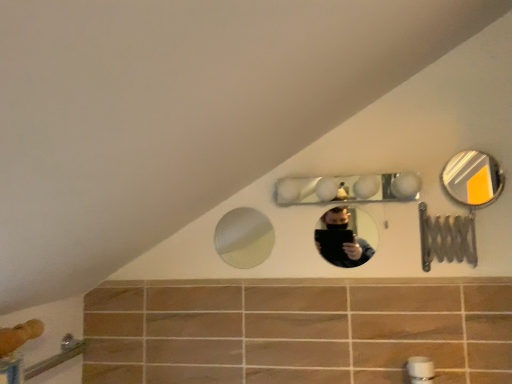
What do you see at coordinates (350, 253) in the screenshot? I see `clear glass mirror at upper center, the 2th mirror when ordered from right to left` at bounding box center [350, 253].

Measure the distance between point (332,188) and camera.

The distance of point (332,188) from camera is 1.30 meters.

How much space does white glossy mirror at upper center, positioned as the second mirror in left-to-right order, occupy vertically?

white glossy mirror at upper center, positioned as the second mirror in left-to-right order, is 4.02 inches tall.

The image size is (512, 384). In order to click on white textured mirror at center, the 1th mirror viewed from the left in this screenshot , I will do `click(244, 238)`.

Where is `metallic silver mirror at upper right, arranged as the fourth mirror when viewed from the left`? Image resolution: width=512 pixels, height=384 pixels. metallic silver mirror at upper right, arranged as the fourth mirror when viewed from the left is located at coordinates (472, 178).

Does clear glass mirror at upper center, the 2th mirror when ordered from right to left, have a greater width compared to white textured mirror at center, the fourth mirror positioned from the right?

Indeed, clear glass mirror at upper center, the 2th mirror when ordered from right to left, has a greater width compared to white textured mirror at center, the fourth mirror positioned from the right.

Is clear glass mirror at upper center, the 3th mirror viewed from the left, not close to white textured mirror at center, the 1th mirror viewed from the left?

clear glass mirror at upper center, the 3th mirror viewed from the left, is positioned a significant distance from white textured mirror at center, the 1th mirror viewed from the left.

I want to click on mirror below the clear glass mirror at upper center, the 3th mirror viewed from the left (from the image's perspective), so click(244, 238).

Would you say clear glass mirror at upper center, the 2th mirror when ordered from right to left, is inside or outside white textured mirror at center, the 1th mirror viewed from the left?

clear glass mirror at upper center, the 2th mirror when ordered from right to left, exists outside the volume of white textured mirror at center, the 1th mirror viewed from the left.

Is point (362, 246) positioned after point (502, 184)?

No, (362, 246) is closer to viewer.

Is there a large distance between clear glass mirror at upper center, the 2th mirror when ordered from right to left, and metallic silver mirror at upper right, arranged as the fourth mirror when viewed from the left?

They are positioned close to each other.

Would you say clear glass mirror at upper center, the 3th mirror viewed from the left, contains metallic silver mirror at upper right, arranged as the fourth mirror when viewed from the left?

No.

Which object is positioned more to the left, clear glass mirror at upper center, the 3th mirror viewed from the left, or white glossy mirror at upper center, positioned as the second mirror in left-to-right order?

From the viewer's perspective, white glossy mirror at upper center, positioned as the second mirror in left-to-right order, appears more on the left side.

Does point (343, 227) come closer to viewer compared to point (356, 176)?

That is False.

Would you say clear glass mirror at upper center, the 3th mirror viewed from the left, is inside or outside white glossy mirror at upper center, which is the third mirror from right to left?

clear glass mirror at upper center, the 3th mirror viewed from the left, is outside white glossy mirror at upper center, which is the third mirror from right to left.

From a real-world perspective, is clear glass mirror at upper center, the 2th mirror when ordered from right to left, positioned over white glossy mirror at upper center, positioned as the second mirror in left-to-right order, based on gravity?

No, from a real-world perspective, clear glass mirror at upper center, the 2th mirror when ordered from right to left, is not on top of white glossy mirror at upper center, positioned as the second mirror in left-to-right order.

Is white glossy mirror at upper center, positioned as the second mirror in left-to-right order, to the left of clear glass mirror at upper center, the 2th mirror when ordered from right to left, from the viewer's perspective?

Yes, white glossy mirror at upper center, positioned as the second mirror in left-to-right order, is to the left of clear glass mirror at upper center, the 2th mirror when ordered from right to left.

Locate an element on the screen. mirror that is the 2nd object located in front of the clear glass mirror at upper center, the 3th mirror viewed from the left is located at coordinates click(x=348, y=189).

Is clear glass mirror at upper center, the 2th mirror when ordered from right to left, at the back of white glossy mirror at upper center, which is the third mirror from right to left?

No, white glossy mirror at upper center, which is the third mirror from right to left, is not facing the opposite direction of clear glass mirror at upper center, the 2th mirror when ordered from right to left.

Is white glossy mirror at upper center, positioned as the second mirror in left-to-right order, shorter than clear glass mirror at upper center, the 3th mirror viewed from the left?

Yes, white glossy mirror at upper center, positioned as the second mirror in left-to-right order, is shorter than clear glass mirror at upper center, the 3th mirror viewed from the left.

Find the location of a particular element. This screenshot has width=512, height=384. mirror that is the 2nd object to the left of the metallic silver mirror at upper right, which is counted as the first mirror, starting from the right, starting at the anchor is located at coordinates [348, 189].

Is white glossy mirror at upper center, positioned as the second mirror in left-to-right order, a part of metallic silver mirror at upper right, which is counted as the first mirror, starting from the right?

No, metallic silver mirror at upper right, which is counted as the first mirror, starting from the right, does not contain white glossy mirror at upper center, positioned as the second mirror in left-to-right order.

Considering their positions, is metallic silver mirror at upper right, which is counted as the first mirror, starting from the right, located in front of or behind white glossy mirror at upper center, positioned as the second mirror in left-to-right order?

metallic silver mirror at upper right, which is counted as the first mirror, starting from the right, is behind white glossy mirror at upper center, positioned as the second mirror in left-to-right order.

Can you tell me how much metallic silver mirror at upper right, which is counted as the first mirror, starting from the right, and white glossy mirror at upper center, which is the third mirror from right to left, differ in facing direction?

The facing directions of metallic silver mirror at upper right, which is counted as the first mirror, starting from the right, and white glossy mirror at upper center, which is the third mirror from right to left, are 0.0187 degrees apart.

Is point (456, 193) closer to camera compared to point (372, 255)?

No, (456, 193) is behind (372, 255).

Considering the sizes of metallic silver mirror at upper right, arranged as the fourth mirror when viewed from the left, and clear glass mirror at upper center, the 3th mirror viewed from the left, in the image, is metallic silver mirror at upper right, arranged as the fourth mirror when viewed from the left, bigger or smaller than clear glass mirror at upper center, the 3th mirror viewed from the left,?

Considering their sizes, metallic silver mirror at upper right, arranged as the fourth mirror when viewed from the left, takes up more space than clear glass mirror at upper center, the 3th mirror viewed from the left.

Looking at this image, is metallic silver mirror at upper right, arranged as the fourth mirror when viewed from the left, aimed at clear glass mirror at upper center, the 2th mirror when ordered from right to left?

No, metallic silver mirror at upper right, arranged as the fourth mirror when viewed from the left, does not turn towards clear glass mirror at upper center, the 2th mirror when ordered from right to left.

Is metallic silver mirror at upper right, which is counted as the first mirror, starting from the right, inside or outside of clear glass mirror at upper center, the 3th mirror viewed from the left?

metallic silver mirror at upper right, which is counted as the first mirror, starting from the right, is spatially situated outside clear glass mirror at upper center, the 3th mirror viewed from the left.

Based on the photo, how many degrees apart are the facing directions of metallic silver mirror at upper right, which is counted as the first mirror, starting from the right, and white textured mirror at center, the 1th mirror viewed from the left?

The angular difference between metallic silver mirror at upper right, which is counted as the first mirror, starting from the right, and white textured mirror at center, the 1th mirror viewed from the left, is 0.99 degrees.

Can you see metallic silver mirror at upper right, which is counted as the first mirror, starting from the right, touching white textured mirror at center, the 1th mirror viewed from the left?

No, metallic silver mirror at upper right, which is counted as the first mirror, starting from the right, is not in contact with white textured mirror at center, the 1th mirror viewed from the left.

Considering the sizes of objects metallic silver mirror at upper right, arranged as the fourth mirror when viewed from the left, and white textured mirror at center, the 1th mirror viewed from the left, in the image provided, who is wider, metallic silver mirror at upper right, arranged as the fourth mirror when viewed from the left, or white textured mirror at center, the 1th mirror viewed from the left,?

metallic silver mirror at upper right, arranged as the fourth mirror when viewed from the left.

In the scene shown: Between metallic silver mirror at upper right, arranged as the fourth mirror when viewed from the left, and white textured mirror at center, the 1th mirror viewed from the left, which one is positioned behind?

Positioned behind is white textured mirror at center, the 1th mirror viewed from the left.

The image size is (512, 384). I want to click on mirror behind the clear glass mirror at upper center, the 3th mirror viewed from the left, so click(244, 238).

The height and width of the screenshot is (384, 512). I want to click on mirror that appears on the right of clear glass mirror at upper center, the 2th mirror when ordered from right to left, so click(472, 178).

Looking at the image, which one is located closer to white textured mirror at center, the fourth mirror positioned from the right, metallic silver mirror at upper right, arranged as the fourth mirror when viewed from the left, or white glossy mirror at upper center, which is the third mirror from right to left?

metallic silver mirror at upper right, arranged as the fourth mirror when viewed from the left, is closer to white textured mirror at center, the fourth mirror positioned from the right.

When comparing their distances from metallic silver mirror at upper right, which is counted as the first mirror, starting from the right, does clear glass mirror at upper center, the 3th mirror viewed from the left, or white textured mirror at center, the fourth mirror positioned from the right, seem closer?

clear glass mirror at upper center, the 3th mirror viewed from the left.

Based on their spatial positions, is white textured mirror at center, the fourth mirror positioned from the right, or white glossy mirror at upper center, positioned as the second mirror in left-to-right order, further from metallic silver mirror at upper right, arranged as the fourth mirror when viewed from the left?

white textured mirror at center, the fourth mirror positioned from the right.

Considering their positions, is white glossy mirror at upper center, positioned as the second mirror in left-to-right order, positioned closer to clear glass mirror at upper center, the 2th mirror when ordered from right to left, than white textured mirror at center, the fourth mirror positioned from the right?

white glossy mirror at upper center, positioned as the second mirror in left-to-right order, is closer to clear glass mirror at upper center, the 2th mirror when ordered from right to left.

Looking at this image, looking at the image, which one is located further to white textured mirror at center, the fourth mirror positioned from the right, metallic silver mirror at upper right, which is counted as the first mirror, starting from the right, or clear glass mirror at upper center, the 3th mirror viewed from the left?

Among the two, metallic silver mirror at upper right, which is counted as the first mirror, starting from the right, is located further to white textured mirror at center, the fourth mirror positioned from the right.

Looking at the image, which one is located closer to clear glass mirror at upper center, the 2th mirror when ordered from right to left, white textured mirror at center, the fourth mirror positioned from the right, or metallic silver mirror at upper right, arranged as the fourth mirror when viewed from the left?

metallic silver mirror at upper right, arranged as the fourth mirror when viewed from the left, lies closer to clear glass mirror at upper center, the 2th mirror when ordered from right to left, than the other object.

Based on their spatial positions, is metallic silver mirror at upper right, arranged as the fourth mirror when viewed from the left, or white textured mirror at center, the fourth mirror positioned from the right, closer to white glossy mirror at upper center, which is the third mirror from right to left?

metallic silver mirror at upper right, arranged as the fourth mirror when viewed from the left, is positioned closer to the anchor white glossy mirror at upper center, which is the third mirror from right to left.

Considering their positions, is white glossy mirror at upper center, positioned as the second mirror in left-to-right order, positioned further to white textured mirror at center, the 1th mirror viewed from the left, than clear glass mirror at upper center, the 2th mirror when ordered from right to left?

Among the two, white glossy mirror at upper center, positioned as the second mirror in left-to-right order, is located further to white textured mirror at center, the 1th mirror viewed from the left.

At what (x,y) coordinates should I click in order to perform the action: click on mirror between white glossy mirror at upper center, which is the third mirror from right to left, and metallic silver mirror at upper right, which is counted as the first mirror, starting from the right. Please return your answer as a coordinate pair (x, y). Looking at the image, I should click on (350, 253).

Find the location of a particular element. mirror between white textured mirror at center, the 1th mirror viewed from the left, and clear glass mirror at upper center, the 2th mirror when ordered from right to left, from left to right is located at coordinates (348, 189).